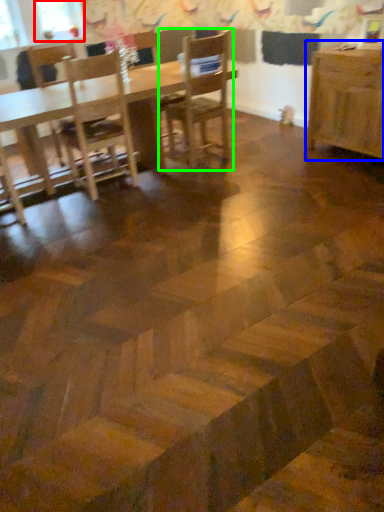
Question: Which object is positioned closest to window screen (highlighted by a red box)? Select from table (highlighted by a blue box) and chair (highlighted by a green box).

Choices:
 (A) table
 (B) chair

Answer: (B)